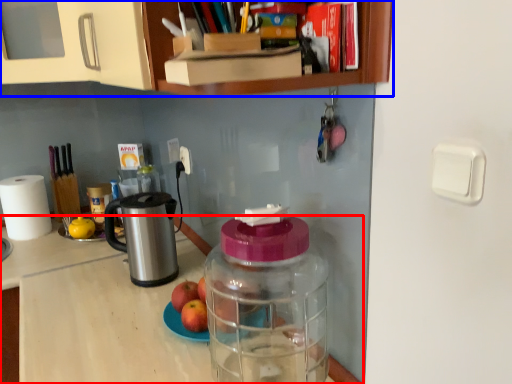
Question: Which of the following is the farthest to the observer, desk (highlighted by a red box) or cabinetry (highlighted by a blue box)?

Choices:
 (A) desk
 (B) cabinetry

Answer: (A)